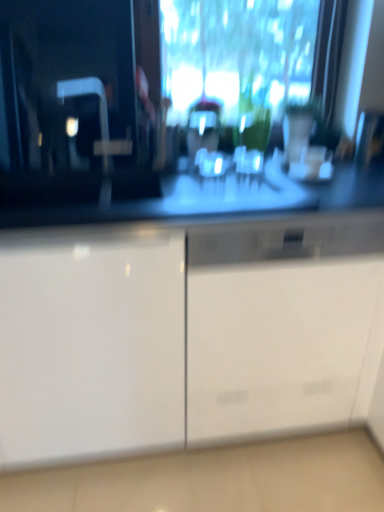
Question: From the image's perspective, is white glossy cabinet at center located above or below white glossy cabinet at left?

Choices:
 (A) below
 (B) above

Answer: (A)

Question: Would you say white glossy cabinet at center is inside or outside white glossy cabinet at left?

Choices:
 (A) inside
 (B) outside

Answer: (B)

Question: In terms of height, does white glossy cabinet at center look taller or shorter compared to white glossy cabinet at left?

Choices:
 (A) tall
 (B) short

Answer: (B)

Question: Is white glossy cabinet at left taller or shorter than white glossy cabinet at center?

Choices:
 (A) short
 (B) tall

Answer: (B)

Question: From a real-world perspective, is white glossy cabinet at left above or below white glossy cabinet at center?

Choices:
 (A) below
 (B) above

Answer: (B)

Question: Based on their sizes in the image, would you say white glossy cabinet at left is bigger or smaller than white glossy cabinet at center?

Choices:
 (A) small
 (B) big

Answer: (B)

Question: Considering the relative positions of white glossy cabinet at left and white glossy cabinet at center in the image provided, is white glossy cabinet at left to the left or to the right of white glossy cabinet at center?

Choices:
 (A) left
 (B) right

Answer: (A)